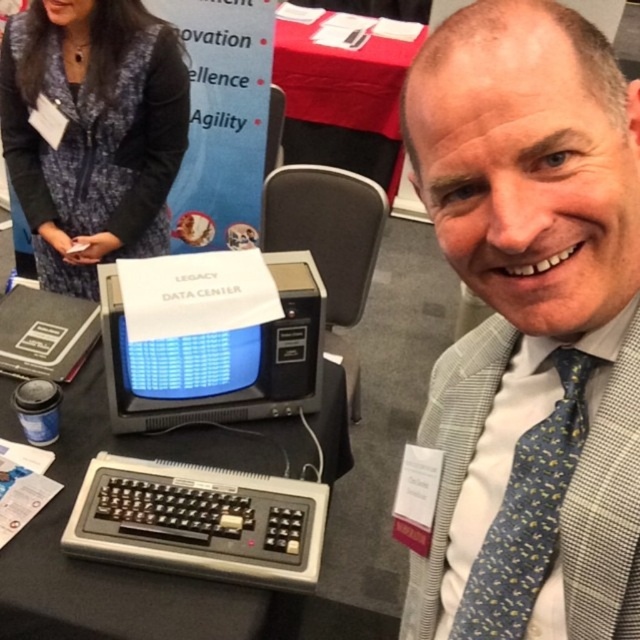
Question: In this image, where is blue textured sweater at upper left located relative to blue dotted silk tie at right?

Choices:
 (A) below
 (B) above

Answer: (B)

Question: Observing the image, what is the correct spatial positioning of gray checkered suit at center in reference to blue textured sweater at upper left?

Choices:
 (A) above
 (B) below

Answer: (B)

Question: Which of these objects is positioned closest to the blue textured sweater at upper left?

Choices:
 (A) black plastic keyboard at lower left
 (B) blue dotted silk tie at right

Answer: (A)

Question: Where is gray checkered suit at center located in relation to blue textured sweater at upper left in the image?

Choices:
 (A) right
 (B) left

Answer: (A)

Question: Among these objects, which one is farthest from the camera?

Choices:
 (A) gray checkered suit at center
 (B) black plastic keyboard at lower left
 (C) blue dotted silk tie at right

Answer: (B)

Question: Which object is the farthest from the black plastic crt monitor at center?

Choices:
 (A) blue dotted silk tie at right
 (B) blue textured sweater at upper left

Answer: (A)